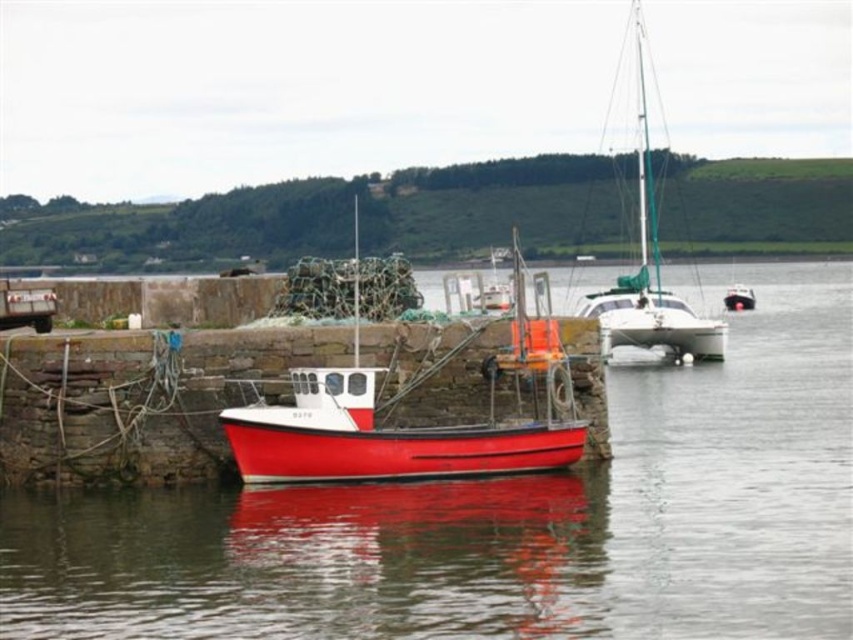
Can you confirm if red matte boat at center is smaller than white glossy sailboat at upper right?

Yes.

Can you confirm if red matte boat at center is positioned to the left of white glossy sailboat at upper right?

Correct, you'll find red matte boat at center to the left of white glossy sailboat at upper right.

Measure the distance between red matte boat at center and camera.

The distance of red matte boat at center from camera is 101.18 feet.

I want to click on red matte boat at center, so click(x=410, y=428).

Is smooth water at boat left wider than white glossy sailboat at upper right?

Yes, smooth water at boat left is wider than white glossy sailboat at upper right.

Between smooth water at boat left and white glossy sailboat at upper right, which one appears on the left side from the viewer's perspective?

smooth water at boat left

Where is `smooth water at boat left`? smooth water at boat left is located at coordinates (506, 522).

Locate an element on the screen. The width and height of the screenshot is (853, 640). smooth water at boat left is located at coordinates (506, 522).

Who is more forward, (734, 600) or (325, 428)?

Point (734, 600) is more forward.

Is smooth water at boat left thinner than red matte boat at center?

No, smooth water at boat left is not thinner than red matte boat at center.

Who is more forward, (480, 525) or (585, 433)?

Point (480, 525)

Where is `smooth water at boat left`? The image size is (853, 640). smooth water at boat left is located at coordinates (506, 522).